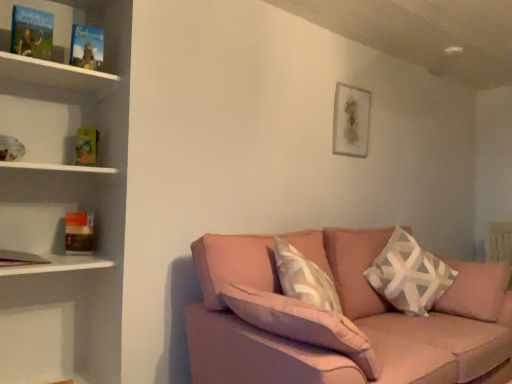
Locate an element on the screen. free point in front of hardcover book at left, arranged as the third paperback book when viewed from the front is located at coordinates 74,258.